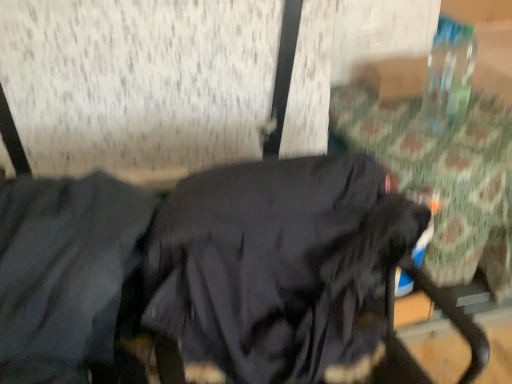
Question: Would you say black matte sweatshirt at center contains dark gray fabric jacket at left?

Choices:
 (A) yes
 (B) no

Answer: (B)

Question: Can you confirm if black matte sweatshirt at center is smaller than dark gray fabric jacket at left?

Choices:
 (A) no
 (B) yes

Answer: (A)

Question: Could you tell me if black matte sweatshirt at center is turned towards dark gray fabric jacket at left?

Choices:
 (A) no
 (B) yes

Answer: (A)

Question: Can you confirm if black matte sweatshirt at center is taller than dark gray fabric jacket at left?

Choices:
 (A) yes
 (B) no

Answer: (A)

Question: From the image's perspective, is black matte sweatshirt at center on top of dark gray fabric jacket at left?

Choices:
 (A) yes
 (B) no

Answer: (B)

Question: Is dark gray fabric jacket at left at the back of black matte sweatshirt at center?

Choices:
 (A) yes
 (B) no

Answer: (B)

Question: Are dark gray fabric jacket at left and black matte sweatshirt at center far apart?

Choices:
 (A) no
 (B) yes

Answer: (A)

Question: From a real-world perspective, is dark gray fabric jacket at left beneath black matte sweatshirt at center?

Choices:
 (A) yes
 (B) no

Answer: (B)

Question: Considering the relative sizes of dark gray fabric jacket at left and black matte sweatshirt at center in the image provided, is dark gray fabric jacket at left taller than black matte sweatshirt at center?

Choices:
 (A) no
 (B) yes

Answer: (A)

Question: Is dark gray fabric jacket at left turned away from black matte sweatshirt at center?

Choices:
 (A) no
 (B) yes

Answer: (A)

Question: Is dark gray fabric jacket at left next to black matte sweatshirt at center?

Choices:
 (A) no
 (B) yes

Answer: (A)

Question: Is dark gray fabric jacket at left bigger than black matte sweatshirt at center?

Choices:
 (A) yes
 (B) no

Answer: (B)

Question: Looking at the image, does black matte sweatshirt at center seem bigger or smaller compared to dark gray fabric jacket at left?

Choices:
 (A) big
 (B) small

Answer: (A)